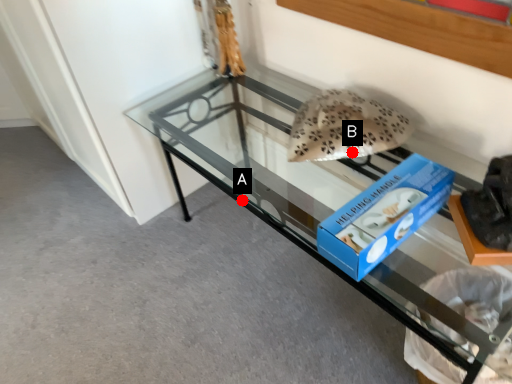
Question: Two points are circled on the image, labeled by A and B beside each circle. Which point appears closest to the camera in this image?

Choices:
 (A) A is closer
 (B) B is closer

Answer: (B)